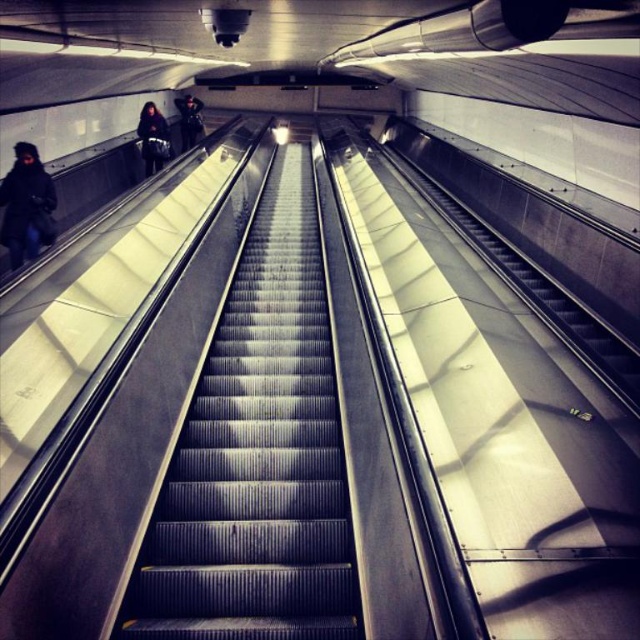
Question: Observing the image, what is the correct spatial positioning of dark blue fabric jacket at left in reference to dark blue jacket at center?

Choices:
 (A) left
 (B) right

Answer: (B)

Question: Does metallic gray stairs at center appear on the right side of dark blue fabric jacket at left?

Choices:
 (A) no
 (B) yes

Answer: (B)

Question: Among these objects, which one is farthest from the camera?

Choices:
 (A) metallic gray stairs at center
 (B) dark blue fabric jacket at left
 (C) dark gray fabric coat at upper left

Answer: (C)

Question: Which of the following is the closest to the observer?

Choices:
 (A) (147, 148)
 (B) (195, 141)
 (C) (6, 205)

Answer: (C)

Question: Does dark gray fabric coat at upper left appear over dark blue jacket at center?

Choices:
 (A) no
 (B) yes

Answer: (A)

Question: Considering the real-world distances, which object is closest to the dark gray fabric coat at upper left?

Choices:
 (A) metallic gray stairs at center
 (B) dark blue jacket at center
 (C) dark blue fabric jacket at left

Answer: (B)